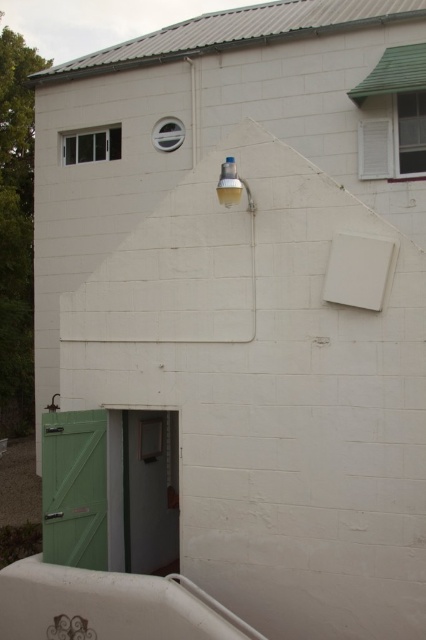
Is point (69, 522) in front of point (394, 145)?

Yes, it is in front of point (394, 145).

The image size is (426, 640). Identify the location of green matte door at lower left. (74, 488).

Locate an element on the screen. green matte door at lower left is located at coordinates [x=74, y=488].

At what (x,y) coordinates should I click in order to perform the action: click on green matte door at lower left. Please return your answer as a coordinate pair (x, y). This screenshot has height=640, width=426. Looking at the image, I should click on (74, 488).

Consider the image. Is white matte window at upper right to the left of clear glass window at upper left from the viewer's perspective?

No, white matte window at upper right is not to the left of clear glass window at upper left.

I want to click on white matte window at upper right, so click(394, 140).

Is green matte door at lower left above clear glass window at upper left?

Incorrect, green matte door at lower left is not positioned above clear glass window at upper left.

Is green matte door at lower left wider than clear glass window at upper left?

No.

Locate an element on the screen. green matte door at lower left is located at coordinates (74, 488).